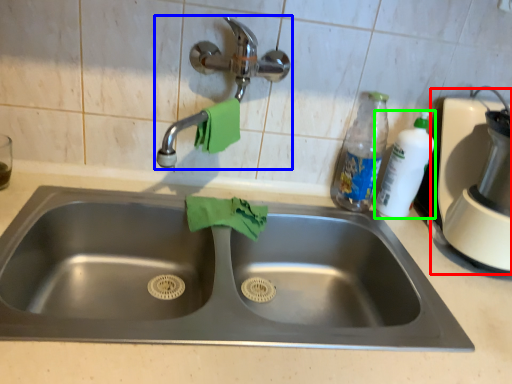
Question: Estimate the real-world distances between objects in this image. Which object is closer to blender (highlighted by a red box), tap (highlighted by a blue box) or cleaning product (highlighted by a green box)?

Choices:
 (A) tap
 (B) cleaning product

Answer: (B)